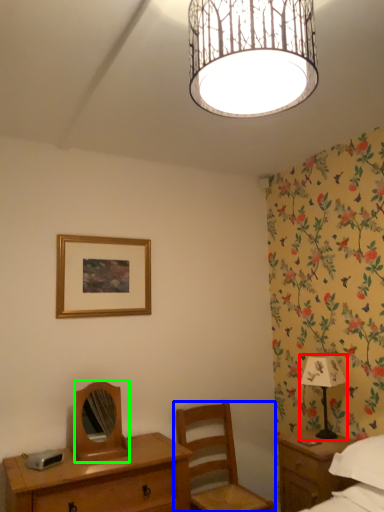
Question: Estimate the real-world distances between objects in this image. Which object is closer to table lamp (highlighted by a red box), chair (highlighted by a blue box) or mirror (highlighted by a green box)?

Choices:
 (A) chair
 (B) mirror

Answer: (A)